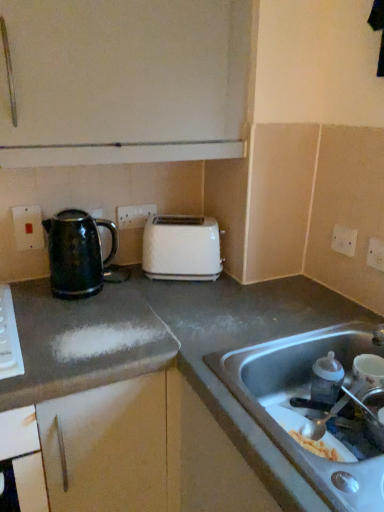
Identify the location of free location to the right of shiny metallic kettle at left. (129, 297).